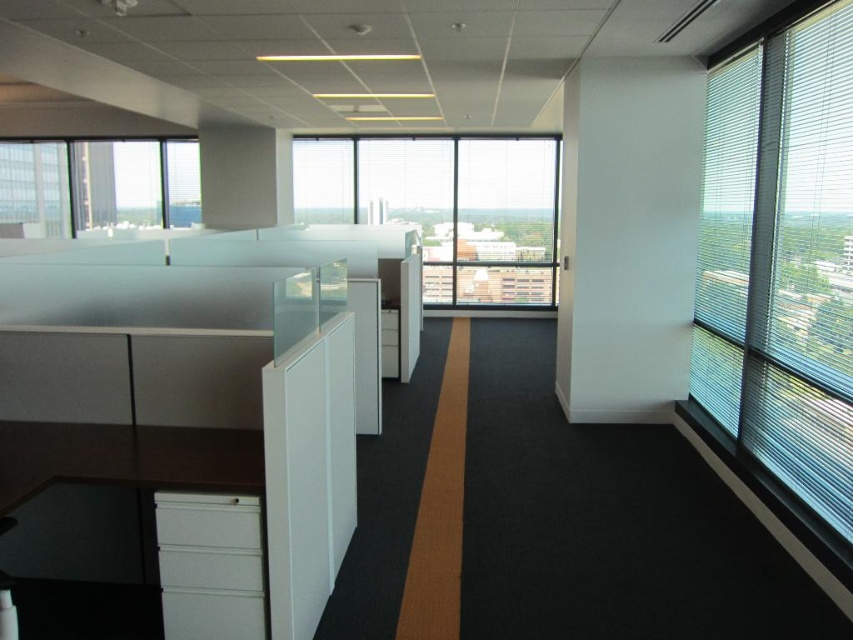
Question: Can you confirm if transparent glass window at center is bigger than clear glass window at upper left?

Choices:
 (A) no
 (B) yes

Answer: (A)

Question: Considering the real-world distances, which object is farthest from the clear glass window at upper left?

Choices:
 (A) transparent glass window at right
 (B) transparent glass window at center

Answer: (A)

Question: Is transparent glass window at right to the left of clear glass window at upper left from the viewer's perspective?

Choices:
 (A) no
 (B) yes

Answer: (A)

Question: Based on their relative distances, which object is nearer to the transparent glass window at right?

Choices:
 (A) clear glass window at upper left
 (B) transparent glass window at center

Answer: (B)

Question: Can you confirm if transparent glass window at center is positioned below clear glass window at upper left?

Choices:
 (A) yes
 (B) no

Answer: (A)

Question: Which point is farther to the camera?

Choices:
 (A) clear glass window at upper left
 (B) transparent glass window at center
 (C) transparent glass window at right

Answer: (B)